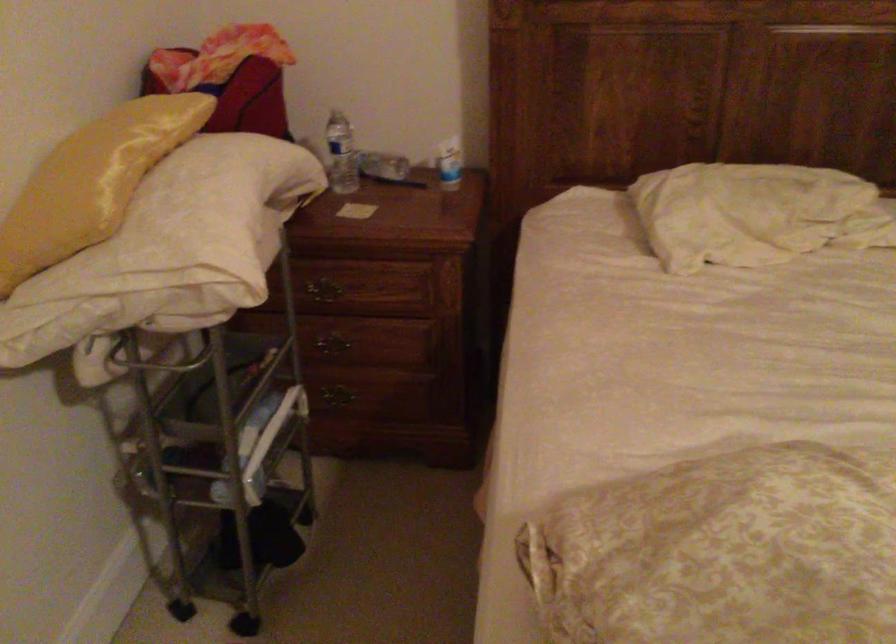
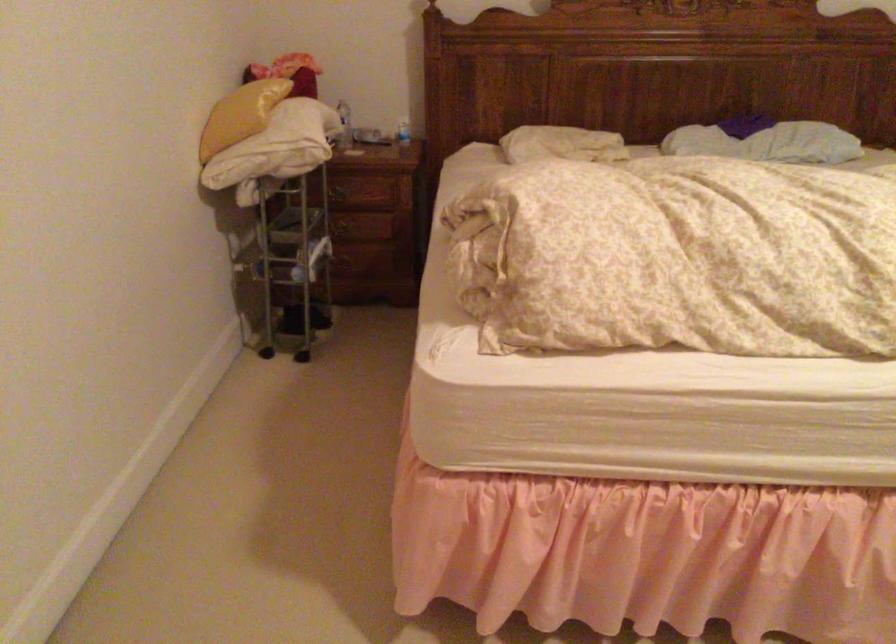
In the second image, find the point that corresponds to (x=316, y=292) in the first image.

(338, 194)